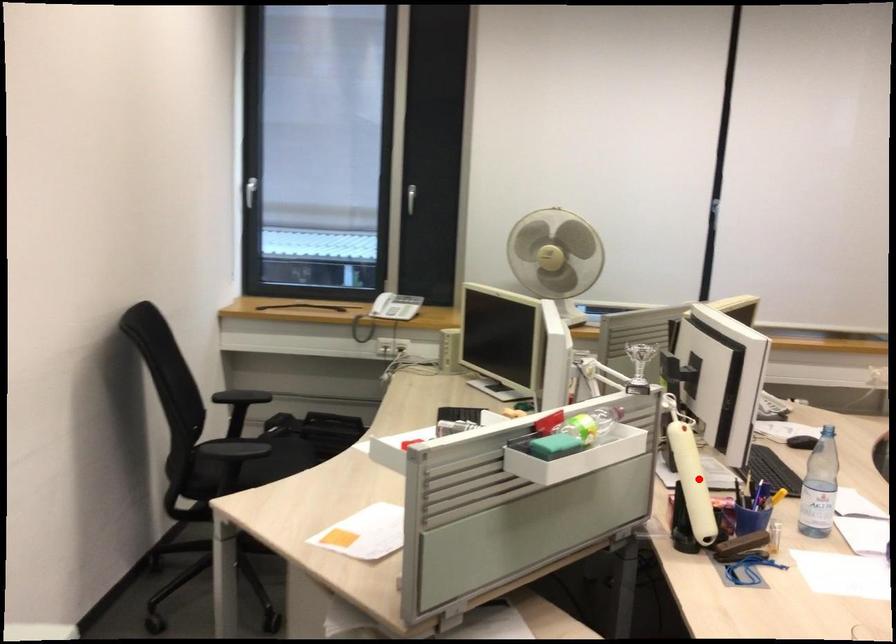
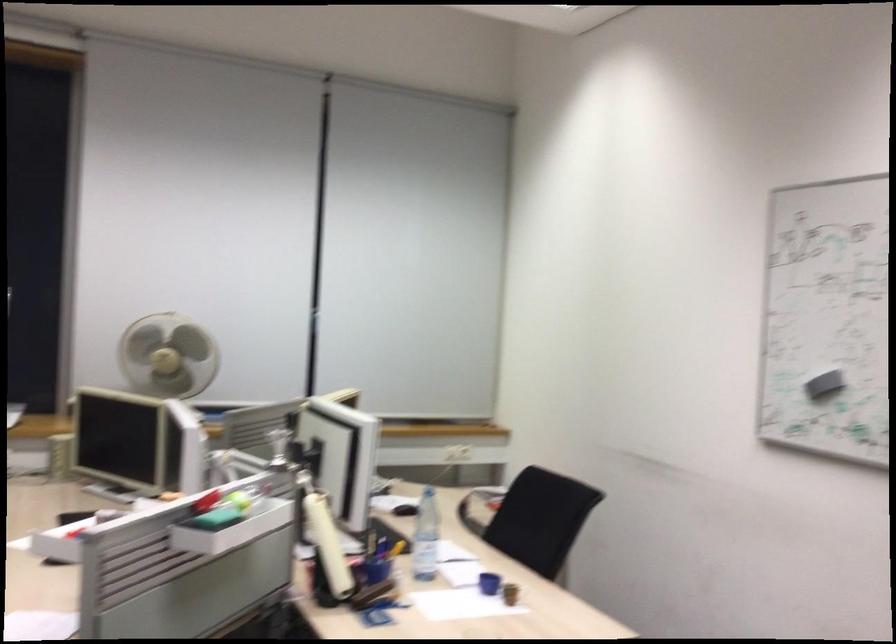
The point at the highlighted location is marked in the first image. Where is the corresponding point in the second image?

(328, 545)